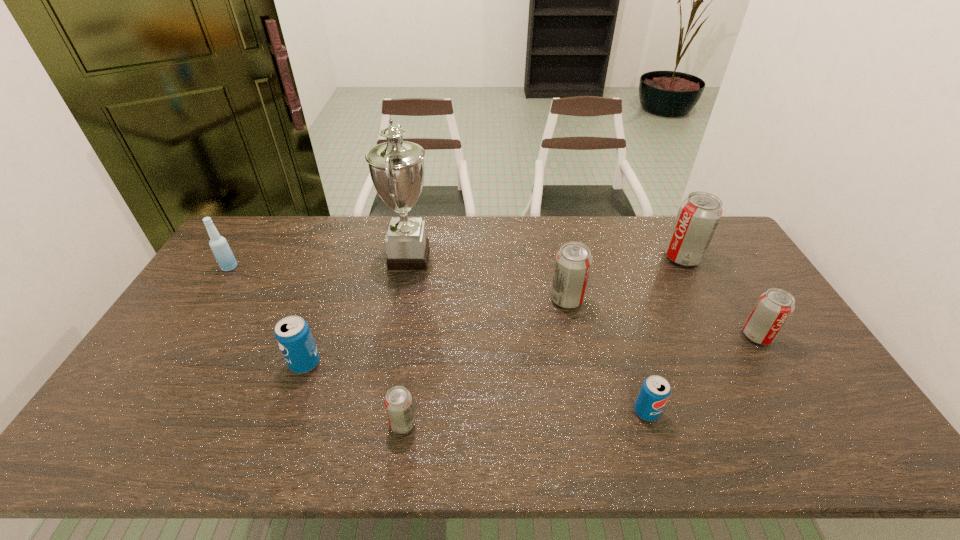
Locate an element on the screen. This screenshot has width=960, height=540. free point between the second object from left to right and the bottle is located at coordinates (268, 315).

This screenshot has height=540, width=960. I want to click on vacant space in between the smallest gray soda can and the farthest gray soda can, so click(x=542, y=340).

Find the location of a particular element. This screenshot has height=540, width=960. object that is the third closest to the sixth farthest object is located at coordinates (219, 246).

Locate which object is the second closest to the third farthest gray soda can. Please provide its 2D coordinates. Your answer should be formatted as a tuple, i.e. [(x, y)], where the tuple contains the x and y coordinates of a point satisfying the conditions above.

[(655, 391)]

This screenshot has width=960, height=540. What are the coordinates of `the fifth closest soda can to the fifth object from left to right` in the screenshot? It's located at (292, 333).

Locate which soda can ranks in proximity to the farthest gray soda can. Please provide its 2D coordinates. Your answer should be formatted as a tuple, i.e. [(x, y)], where the tuple contains the x and y coordinates of a point satisfying the conditions above.

[(773, 309)]

Locate an element on the screen. gray soda can that stands as the second closest to the tallest object is located at coordinates (398, 403).

Find the location of a particular element. The image size is (960, 540). the third closest gray soda can to the third gray soda can from right to left is located at coordinates 398,403.

Find the location of a particular element. Image resolution: width=960 pixels, height=540 pixels. vacant space that satisfies the following two spatial constraints: 1. on the back side of the fourth nearest object; 2. on the right side of the fourth farthest soda can is located at coordinates (315, 336).

The width and height of the screenshot is (960, 540). I want to click on vacant position in the image that satisfies the following two spatial constraints: 1. at the front view of the trophy cup; 2. on the left side of the sixth object from left to right, so click(x=380, y=411).